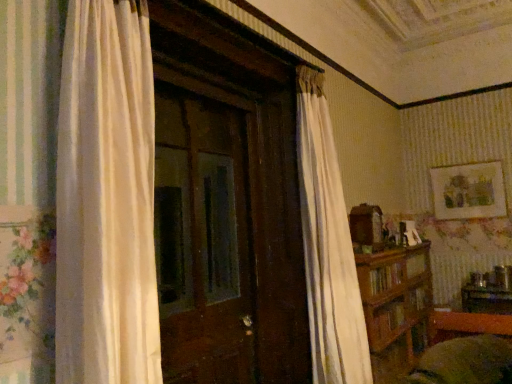
Question: In terms of height, does brown wooden bookshelf at right look taller or shorter compared to wooden table at lower right?

Choices:
 (A) short
 (B) tall

Answer: (B)

Question: Is brown wooden bookshelf at right in front of or behind wooden table at lower right in the image?

Choices:
 (A) front
 (B) behind

Answer: (A)

Question: Which of these objects is positioned closest to the brown wooden bookshelf at right?

Choices:
 (A) matte gold picture frame at upper right
 (B) wooden table at lower right

Answer: (B)

Question: Estimate the real-world distances between objects in this image. Which object is closer to the wooden table at lower right?

Choices:
 (A) brown wooden bookshelf at right
 (B) matte gold picture frame at upper right

Answer: (A)